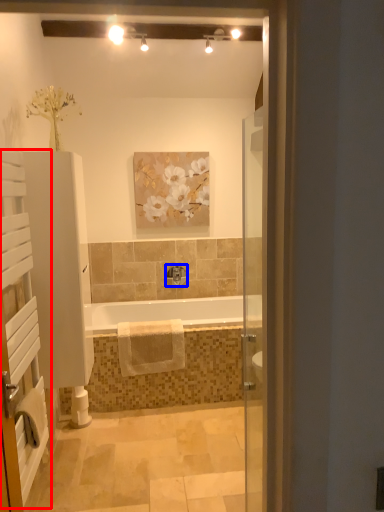
Question: Which object is closer to the camera taking this photo, screen door (highlighted by a red box) or tap (highlighted by a blue box)?

Choices:
 (A) screen door
 (B) tap

Answer: (A)